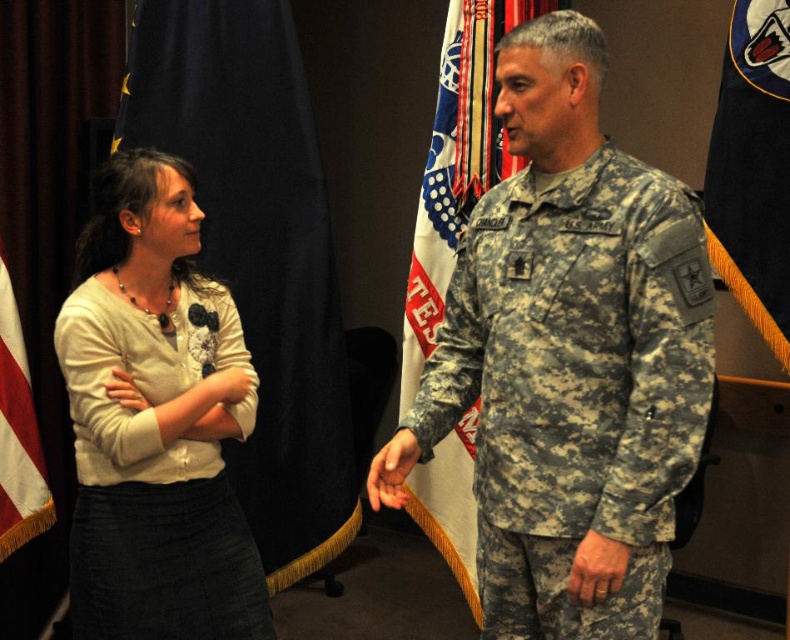
You are an observer at a formal event. You notice the white matte cardigan at center and the blue fabric flag at left. Which object is taller?

The blue fabric flag at left is taller than the white matte cardigan at center.

What is the 2D coordinate of the camouflage uniform at center?

The 2D coordinate of the camouflage uniform at center is at point (567, 358).